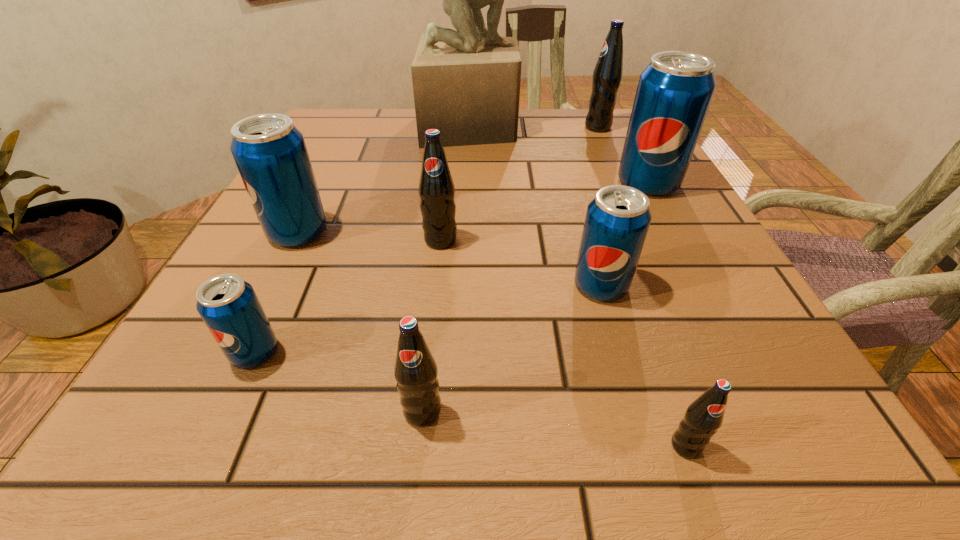
In order to click on vacant space located 0.080m on the front label of the biggest black pop in this screenshot , I will do `click(552, 127)`.

Locate an element on the screen. This screenshot has width=960, height=540. vacant space located 0.350m on the front label of the third smallest black pop is located at coordinates (418, 457).

Locate an element on the screen. The height and width of the screenshot is (540, 960). vacant region located 0.370m on the right of the second biggest blue pop soda is located at coordinates 541,232.

Locate an element on the screen. The height and width of the screenshot is (540, 960). free space located on the back of the fourth nearest pop is located at coordinates (587, 237).

This screenshot has width=960, height=540. In order to click on vacant space positioned on the back of the seventh farthest object in this screenshot , I will do `click(314, 225)`.

The height and width of the screenshot is (540, 960). In order to click on sculpture that is at the far edge in this screenshot , I will do `click(466, 83)`.

The height and width of the screenshot is (540, 960). In order to click on pop that is positioned at the far edge in this screenshot , I will do `click(607, 75)`.

Locate an element on the screen. object that is at the far right corner is located at coordinates (607, 75).

What are the coordinates of `object that is at the near right corner` in the screenshot? It's located at (704, 416).

In the image, there is a desktop. What are the coordinates of `free space at the far edge` in the screenshot? It's located at (535, 139).